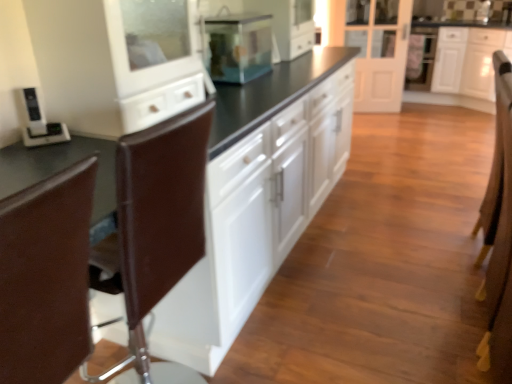
Locate an element on the screen. vacant region under brown leather armchair at right (from a real-world perspective) is located at coordinates (470, 248).